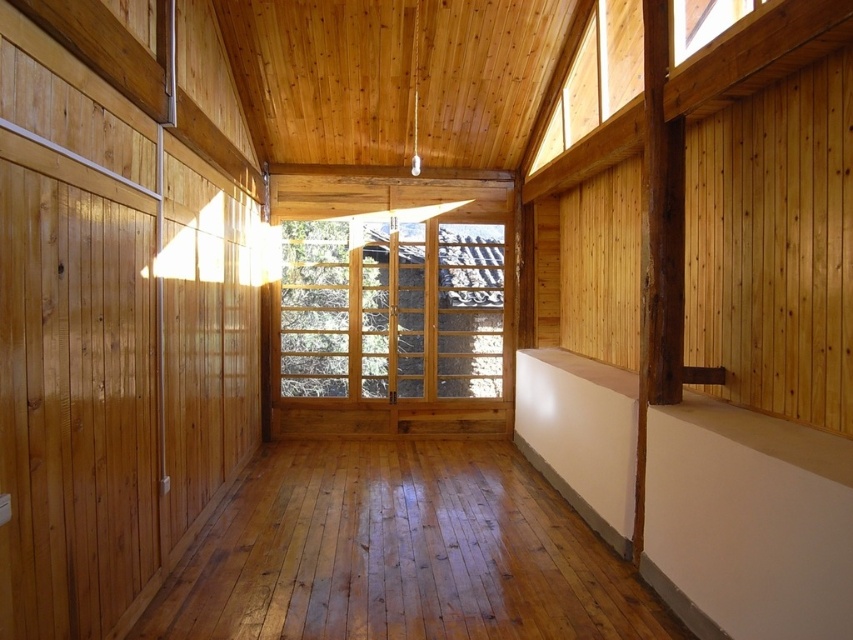
Who is more forward, (x=479, y=308) or (x=701, y=20)?

Point (x=701, y=20) is in front.

Is clear glass window at center shorter than clear glass window at upper right?

No, clear glass window at center is not shorter than clear glass window at upper right.

Between point (498, 298) and point (708, 33), which one is positioned behind?

The point (498, 298) is behind.

You are a GUI agent. You are given a task and a screenshot of the screen. Output one action in this format:
    pyautogui.click(x=<x>, y=<y>)
    Task: Click on the clear glass window at center
    This screenshot has height=640, width=853.
    Given the screenshot: What is the action you would take?
    pyautogui.click(x=392, y=308)